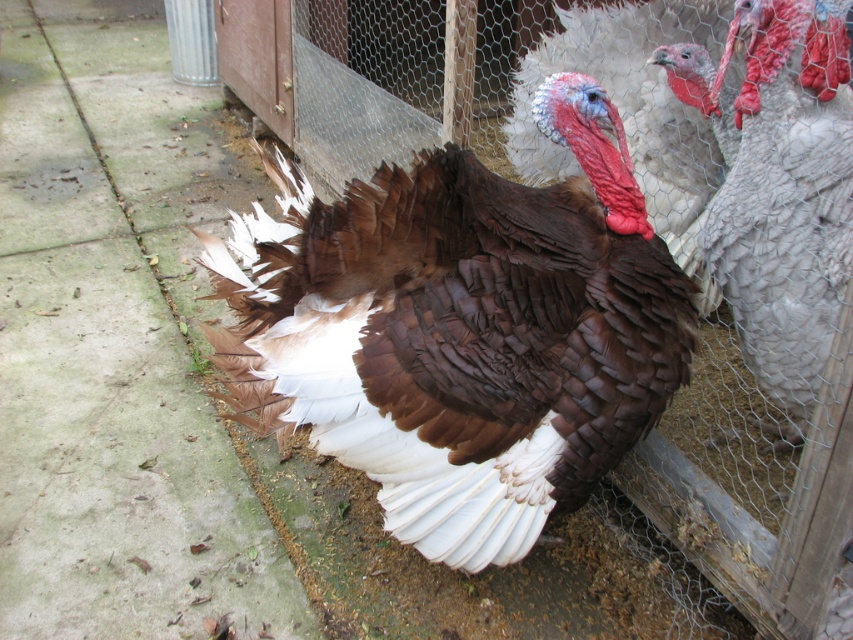
You are a farmer who needs to separate the brown glossy turkey at center and the white feathered turkey at right using a divider. The divider must be placed exactly between them. What is the minimum width of the divider needed to ensure they cannot see each other?

The divider must be at least 24.66 inches wide to ensure the brown glossy turkey at center and the white feathered turkey at right cannot see each other since they are 24.66 inches apart.

You are standing in front of the turkey and want to touch the two points on its body. The first point is at coordinate point [685,376] and the second is at point [746,284]. Which point should you reach for first if you want to touch the closer one?

Point [685,376] is closer to the viewer than point [746,284], so you should reach for point [685,376] first.